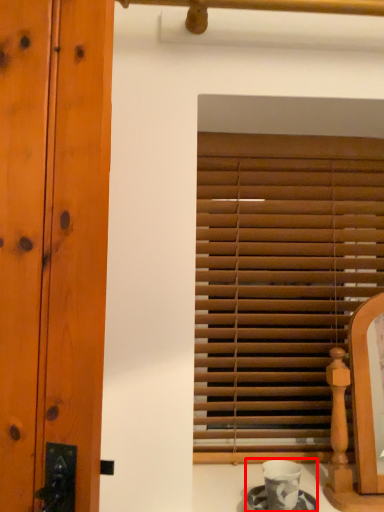
Question: In this image, where is tea set (annotated by the red box) located relative to window blind?

Choices:
 (A) left
 (B) right

Answer: (A)